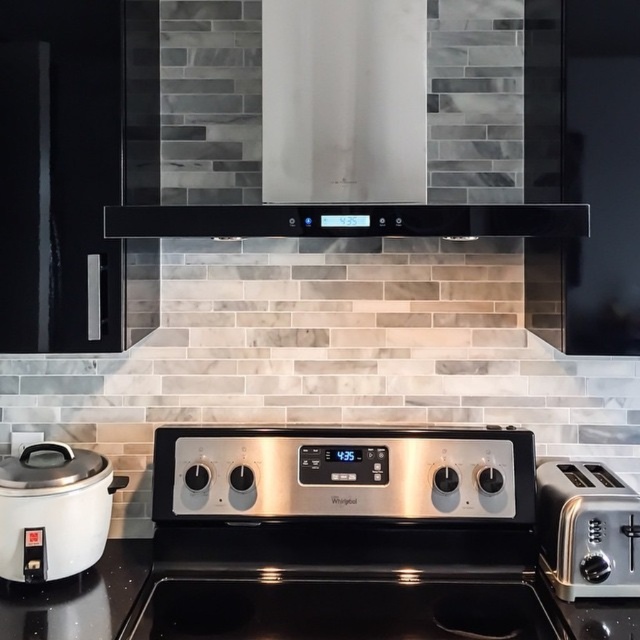
Question: Which of the following is the farthest from the observer?

Choices:
 (A) satin silver toaster at right
 (B) white glossy rice cooker at lower left
 (C) black glass exhaust hood at upper center
 (D) black glossy countertop at lower center

Answer: (A)

Question: Where is black glass exhaust hood at upper center located in relation to white glossy rice cooker at lower left in the image?

Choices:
 (A) right
 (B) left

Answer: (A)

Question: Which of these objects is positioned farthest from the white glossy rice cooker at lower left?

Choices:
 (A) black glass exhaust hood at upper center
 (B) satin silver toaster at right

Answer: (B)

Question: Among these points, which one is nearest to the camera?

Choices:
 (A) (17, 536)
 (B) (420, 205)
 (C) (541, 557)
 (D) (618, 632)

Answer: (B)

Question: Does black glossy countertop at lower center appear on the right side of satin silver toaster at right?

Choices:
 (A) no
 (B) yes

Answer: (A)

Question: Can you confirm if black glossy countertop at lower center is bigger than black glass exhaust hood at upper center?

Choices:
 (A) no
 (B) yes

Answer: (B)